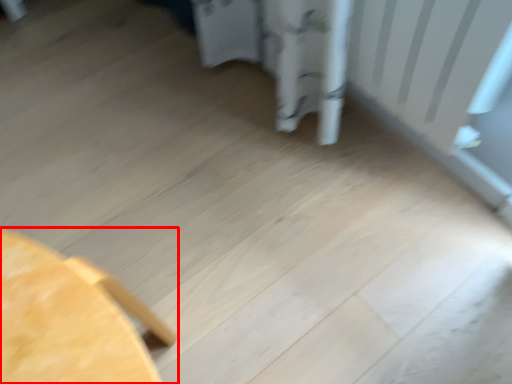
Question: From the image's perspective, where is furniture (annotated by the red box) located relative to radiator?

Choices:
 (A) below
 (B) above

Answer: (A)